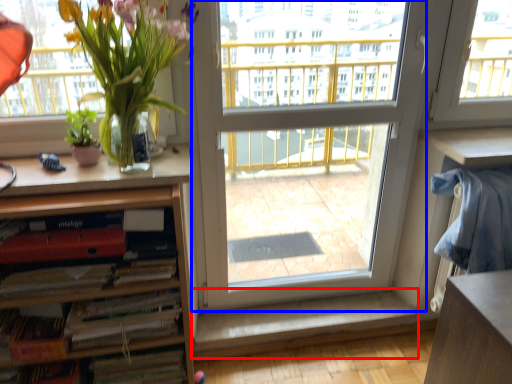
Question: Which point is closer to the camera, window sill (highlighted by a red box) or screen door (highlighted by a blue box)?

Choices:
 (A) window sill
 (B) screen door

Answer: (B)